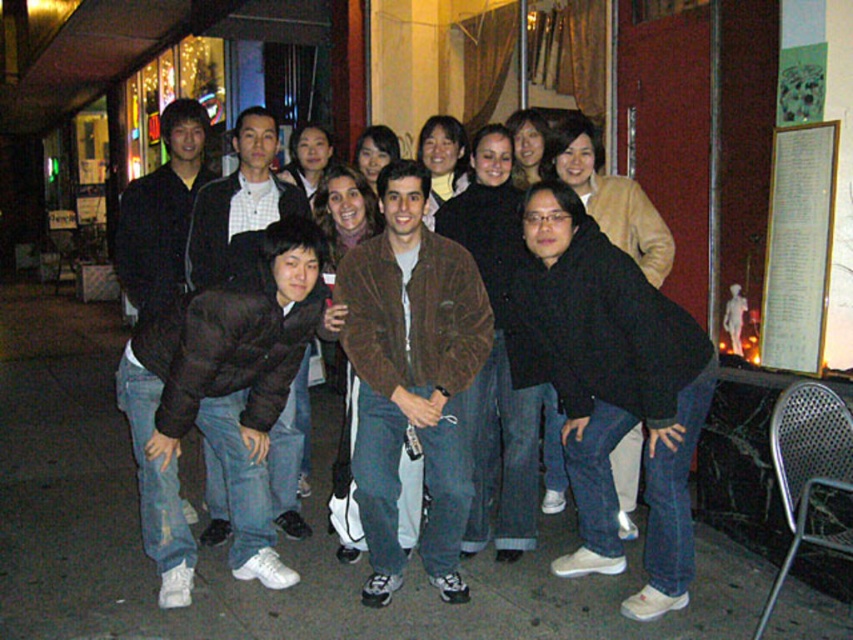
Based on the photo, you are standing in front of the building in the background of the night scene. There are two points marked on the building wall at coordinates point (340, 336) and point (234, 125). If you want to touch both points starting from your current position, which point should you reach first?

You should reach point (340, 336) first because it is closer to you than point (234, 125), so you can touch it before moving to the farther one.

You are a photographer trying to capture a group photo. You notice two jackets in the frame. The dark brown puffy jacket at lower left and the brown fuzzy jacket at center. Which jacket would you need to adjust in the photo to ensure both jackets appear proportionally sized relative to their actual sizes?

The dark brown puffy jacket at lower left is larger in width than the brown fuzzy jacket at center. To ensure proportional sizing, you should adjust the dark brown puffy jacket at lower left to make it smaller or move it further away from the camera.